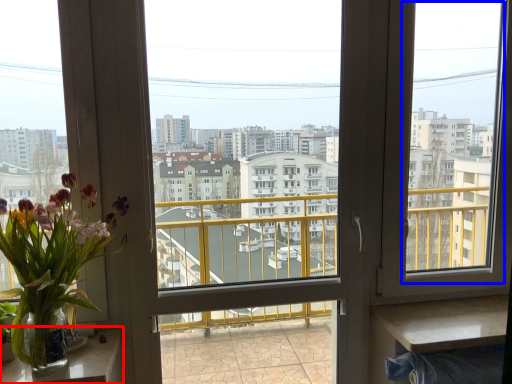
Question: Among these objects, which one is farthest to the camera, table (highlighted by a red box) or window screen (highlighted by a blue box)?

Choices:
 (A) table
 (B) window screen

Answer: (B)